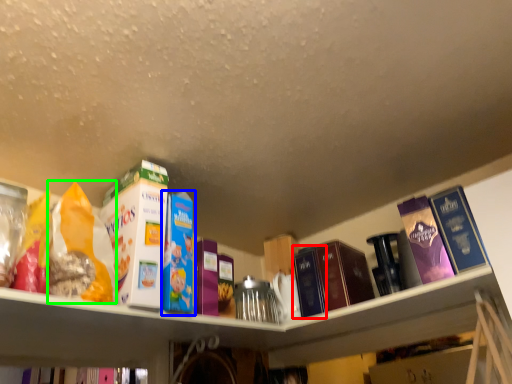
Question: Which object is the closest to the book (highlighted by a red box)? Choose among these: book (highlighted by a blue box) or cereal (highlighted by a green box).

Choices:
 (A) book
 (B) cereal

Answer: (A)